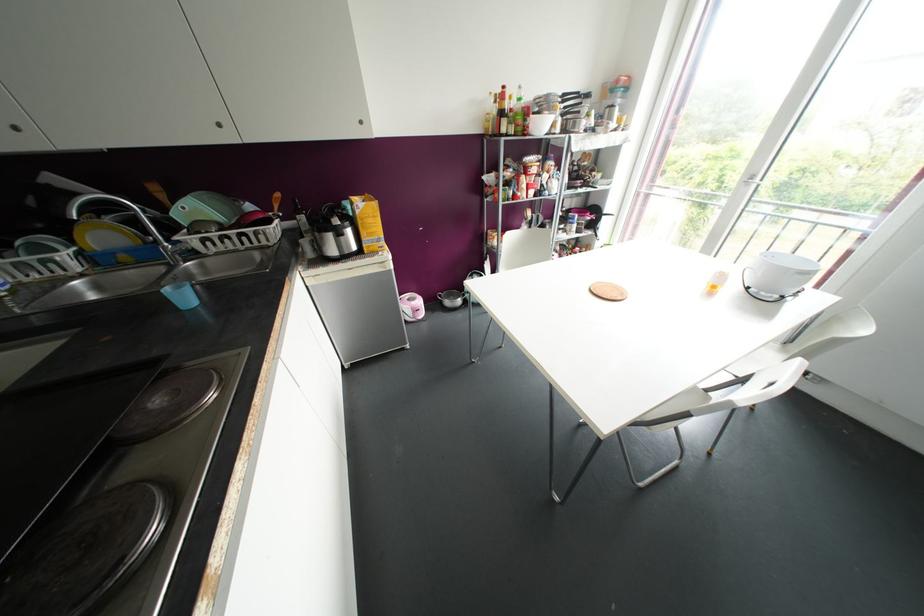
This screenshot has height=616, width=924. I want to click on pink rice cooker, so click(410, 306).